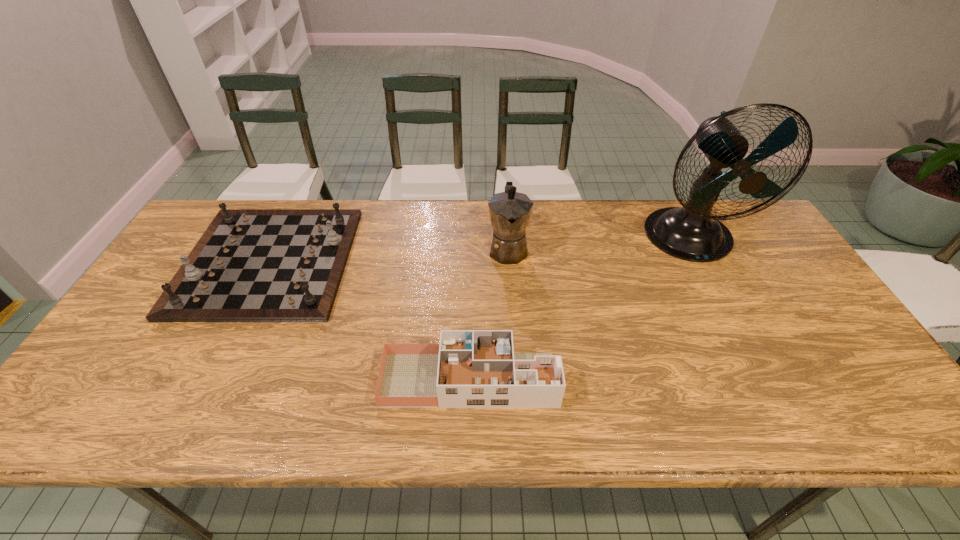
Where is `free space between the leftmost object and the coffeepot`? free space between the leftmost object and the coffeepot is located at coordinates (388, 255).

This screenshot has width=960, height=540. Identify the location of object that stands as the closest to the third shortest object. (469, 368).

Identify which object is the second nearest to the tallest object. Please provide its 2D coordinates. Your answer should be formatted as a tuple, i.e. [(x, y)], where the tuple contains the x and y coordinates of a point satisfying the conditions above.

[(469, 368)]

Find the location of `vacant region that satisfies the following two spatial constraints: 1. on the pouring side of the second tallest object; 2. on the board of the chessboard`. vacant region that satisfies the following two spatial constraints: 1. on the pouring side of the second tallest object; 2. on the board of the chessboard is located at coordinates (509, 261).

Find the location of a particular element. free spot that satisfies the following two spatial constraints: 1. on the front-facing side of the tallest object; 2. at the front door of the dollhouse is located at coordinates (x=763, y=380).

This screenshot has height=540, width=960. What are the coordinates of `vacant space that satisfies the following two spatial constraints: 1. on the front-facing side of the fan; 2. on the board of the leftmost object` in the screenshot? It's located at (702, 261).

This screenshot has height=540, width=960. What are the coordinates of `free location that satisfies the following two spatial constraints: 1. on the pouring side of the second tallest object; 2. on the board of the leftmost object` in the screenshot? It's located at (509, 261).